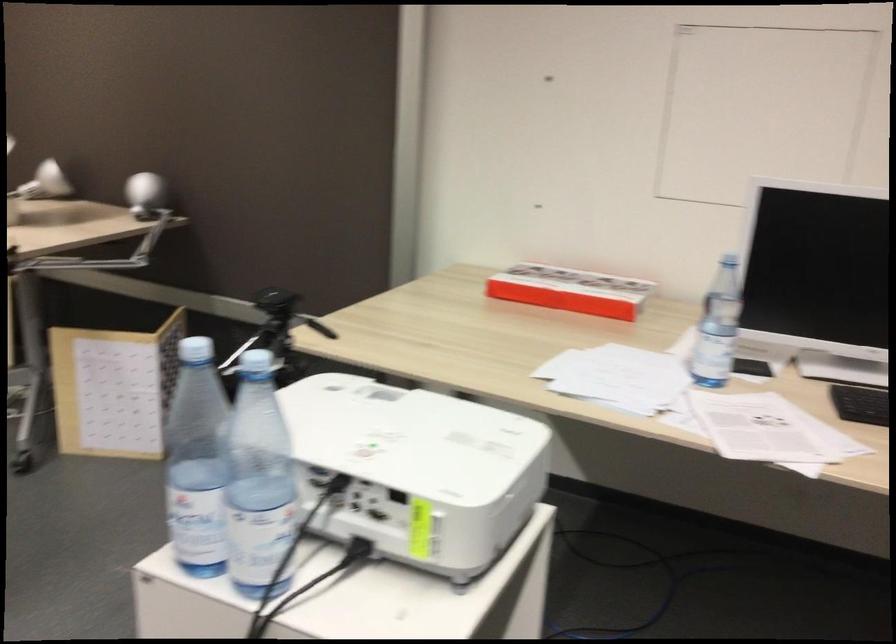
Describe the element at coordinates (143, 194) in the screenshot. The height and width of the screenshot is (644, 896). I see `the projector lens ring` at that location.